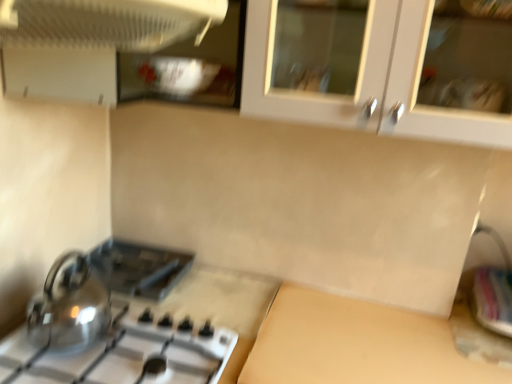
Question: Can you see white plastic fan at upper left, which is the 2th kitchen appliance from back to front, touching shiny metallic kettle at lower left, arranged as the second kitchen appliance when viewed from the top?

Choices:
 (A) yes
 (B) no

Answer: (B)

Question: Is white plastic fan at upper left, the first kitchen appliance from the front, far away from shiny metallic kettle at lower left, which is the 1th kitchen appliance in back-to-front order?

Choices:
 (A) no
 (B) yes

Answer: (A)

Question: Can you confirm if white plastic fan at upper left, which is the 2th kitchen appliance from back to front, is positioned to the right of shiny metallic kettle at lower left, which is the 1th kitchen appliance from bottom to top?

Choices:
 (A) no
 (B) yes

Answer: (B)

Question: Is white plastic fan at upper left, which is the 2th kitchen appliance from back to front, wider than shiny metallic kettle at lower left, arranged as the second kitchen appliance when viewed from the top?

Choices:
 (A) no
 (B) yes

Answer: (B)

Question: Can you confirm if white plastic fan at upper left, the first kitchen appliance from the front, is thinner than shiny metallic kettle at lower left, which is counted as the second kitchen appliance, starting from the front?

Choices:
 (A) yes
 (B) no

Answer: (B)

Question: In the image, is black plastic toaster at lower left positioned in front of or behind beige matte counter top at lower center?

Choices:
 (A) behind
 (B) front

Answer: (A)

Question: From a real-world perspective, is black plastic toaster at lower left positioned above or below beige matte counter top at lower center?

Choices:
 (A) above
 (B) below

Answer: (A)

Question: Is black plastic toaster at lower left wider or thinner than beige matte counter top at lower center?

Choices:
 (A) wide
 (B) thin

Answer: (B)

Question: Is black plastic toaster at lower left inside the boundaries of beige matte counter top at lower center, or outside?

Choices:
 (A) inside
 (B) outside

Answer: (B)

Question: Considering the relative positions of white plastic fan at upper left, which ranks as the second kitchen appliance in bottom-to-top order, and metallic silver sink at lower right in the image provided, is white plastic fan at upper left, which ranks as the second kitchen appliance in bottom-to-top order, to the left or to the right of metallic silver sink at lower right?

Choices:
 (A) right
 (B) left

Answer: (B)

Question: Is point (164, 31) closer or farther from the camera than point (484, 274)?

Choices:
 (A) farther
 (B) closer

Answer: (B)

Question: In the image, is white plastic fan at upper left, the first kitchen appliance from the front, positioned in front of or behind metallic silver sink at lower right?

Choices:
 (A) front
 (B) behind

Answer: (A)

Question: In terms of height, does white plastic fan at upper left, which is the 2th kitchen appliance from back to front, look taller or shorter compared to metallic silver sink at lower right?

Choices:
 (A) short
 (B) tall

Answer: (B)

Question: Relative to white plastic fan at upper left, the first kitchen appliance from the front, is shiny metallic gas stove at lower left in front or behind?

Choices:
 (A) behind
 (B) front

Answer: (A)

Question: From a real-world perspective, is shiny metallic gas stove at lower left positioned above or below white plastic fan at upper left, the first kitchen appliance from the front?

Choices:
 (A) below
 (B) above

Answer: (A)